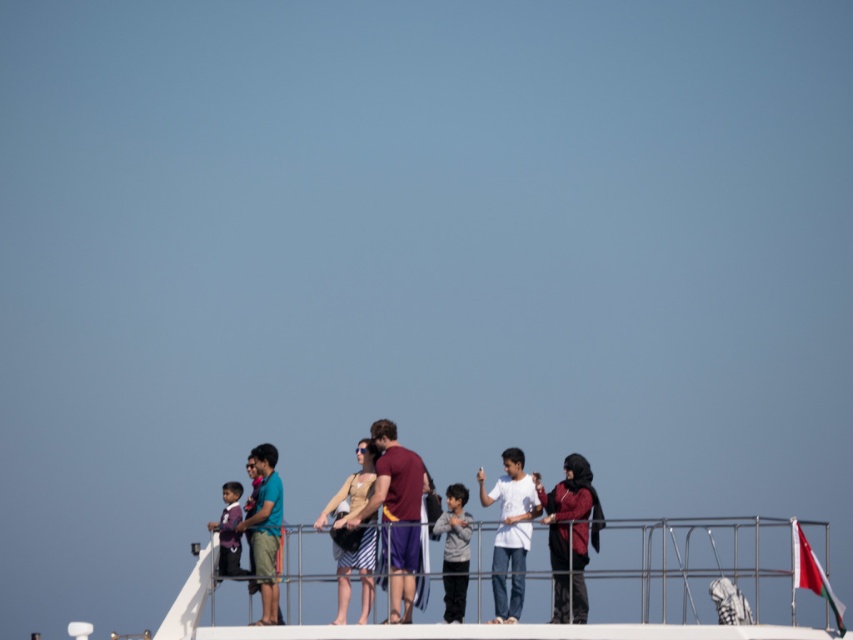
Which is more to the right, white matte shirt at center or matte purple shirt at center?

white matte shirt at center

Who is higher up, white matte shirt at center or matte purple shirt at center?

matte purple shirt at center is above.

Describe the element at coordinates (509, 531) in the screenshot. I see `white matte shirt at center` at that location.

Where is `white matte shirt at center`? Image resolution: width=853 pixels, height=640 pixels. white matte shirt at center is located at coordinates (509, 531).

Does maroon fabric shirt at center appear under matte purple shirt at center?

No, maroon fabric shirt at center is not below matte purple shirt at center.

Looking at this image, which is above, maroon fabric shirt at center or matte purple shirt at center?

Positioned higher is maroon fabric shirt at center.

Who is more distant from viewer, (393, 609) or (221, 531)?

The point (221, 531) is behind.

Where is `maroon fabric shirt at center`? maroon fabric shirt at center is located at coordinates (397, 513).

Does maroon fabric shirt at center have a greater width compared to gray cotton hoodie at center?

Yes.

Identify the location of maroon fabric shirt at center. (397, 513).

In the scene shown: Who is more forward, (364, 506) or (469, 515)?

Point (364, 506)

This screenshot has width=853, height=640. I want to click on maroon fabric shirt at center, so click(397, 513).